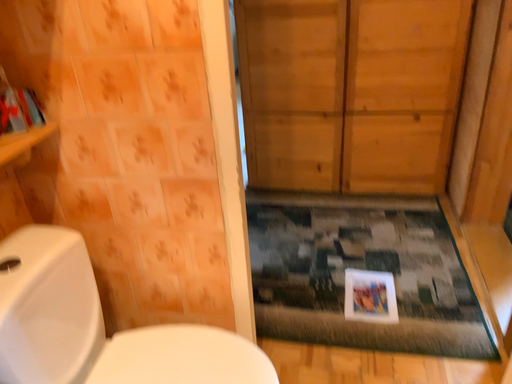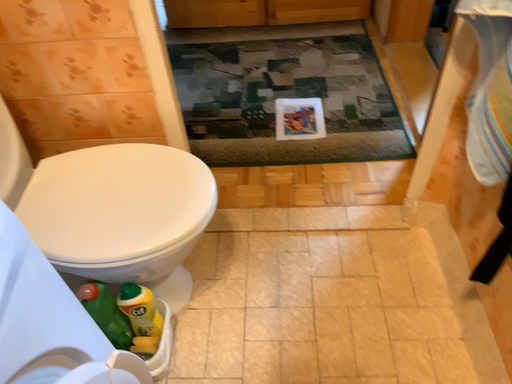
Question: How did the camera likely rotate when shooting the video?

Choices:
 (A) rotated right
 (B) rotated left

Answer: (A)